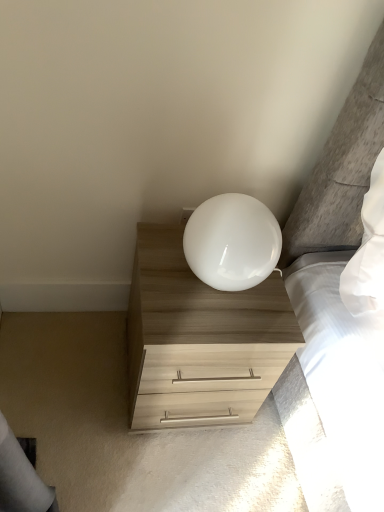
Image resolution: width=384 pixels, height=512 pixels. I want to click on light wood/texture chest of drawers at lower right, so click(x=200, y=339).

Describe the element at coordinates (200, 339) in the screenshot. I see `light wood/texture chest of drawers at lower right` at that location.

Where is `white glossy lamp at upper center`? The height and width of the screenshot is (512, 384). white glossy lamp at upper center is located at coordinates (232, 242).

What do you see at coordinates (232, 242) in the screenshot?
I see `white glossy lamp at upper center` at bounding box center [232, 242].

Find the location of a particular element. light wood/texture chest of drawers at lower right is located at coordinates (200, 339).

Can you confirm if white glossy lamp at upper center is positioned to the left of light wood/texture chest of drawers at lower right?

No, white glossy lamp at upper center is not to the left of light wood/texture chest of drawers at lower right.

Which object is closer to the camera taking this photo, white glossy lamp at upper center or light wood/texture chest of drawers at lower right?

white glossy lamp at upper center.

Does point (244, 242) appear closer or farther from the camera than point (240, 307)?

Point (244, 242) is positioned closer to the camera compared to point (240, 307).

From the picture: From the image's perspective, is white glossy lamp at upper center located above or below light wood/texture chest of drawers at lower right?

white glossy lamp at upper center is situated higher than light wood/texture chest of drawers at lower right in the image.

From a real-world perspective, is white glossy lamp at upper center physically above light wood/texture chest of drawers at lower right?

Yes, from a real-world perspective, white glossy lamp at upper center is over light wood/texture chest of drawers at lower right

Looking at this image, which of these two, white glossy lamp at upper center or light wood/texture chest of drawers at lower right, is thinner?

With smaller width is white glossy lamp at upper center.

Does white glossy lamp at upper center have a lesser height compared to light wood/texture chest of drawers at lower right?

Correct, white glossy lamp at upper center is not as tall as light wood/texture chest of drawers at lower right.

Can you confirm if white glossy lamp at upper center is bigger than light wood/texture chest of drawers at lower right?

Actually, white glossy lamp at upper center might be smaller than light wood/texture chest of drawers at lower right.

Is light wood/texture chest of drawers at lower right located within white glossy lamp at upper center?

No, light wood/texture chest of drawers at lower right is not a part of white glossy lamp at upper center.

Are white glossy lamp at upper center and light wood/texture chest of drawers at lower right making contact?

No, white glossy lamp at upper center is not touching light wood/texture chest of drawers at lower right.

Is white glossy lamp at upper center facing towards light wood/texture chest of drawers at lower right?

No, white glossy lamp at upper center is not turned towards light wood/texture chest of drawers at lower right.

The height and width of the screenshot is (512, 384). I want to click on chest of drawers lying on the left of white glossy lamp at upper center, so click(x=200, y=339).

Is light wood/texture chest of drawers at lower right to the left of white glossy lamp at upper center from the viewer's perspective?

Yes, light wood/texture chest of drawers at lower right is to the left of white glossy lamp at upper center.

Who is more distant, light wood/texture chest of drawers at lower right or white glossy lamp at upper center?

light wood/texture chest of drawers at lower right is more distant.

Between point (263, 351) and point (198, 207), which one is positioned behind?

The point (263, 351) is more distant.

From the image's perspective, would you say light wood/texture chest of drawers at lower right is shown under white glossy lamp at upper center?

Yes, from the image's perspective, light wood/texture chest of drawers at lower right is beneath white glossy lamp at upper center.

In the scene shown: From a real-world perspective, is light wood/texture chest of drawers at lower right above or below white glossy lamp at upper center?

light wood/texture chest of drawers at lower right is situated lower than white glossy lamp at upper center in the real world.

Can you confirm if light wood/texture chest of drawers at lower right is thinner than white glossy lamp at upper center?

No.

Considering the relative sizes of light wood/texture chest of drawers at lower right and white glossy lamp at upper center in the image provided, is light wood/texture chest of drawers at lower right shorter than white glossy lamp at upper center?

No.

Which of these two, light wood/texture chest of drawers at lower right or white glossy lamp at upper center, is bigger?

With larger size is light wood/texture chest of drawers at lower right.

Is light wood/texture chest of drawers at lower right located outside white glossy lamp at upper center?

That's correct, light wood/texture chest of drawers at lower right is outside of white glossy lamp at upper center.

Is the surface of light wood/texture chest of drawers at lower right in direct contact with white glossy lamp at upper center?

They are not placed beside each other.

Is light wood/texture chest of drawers at lower right facing away from white glossy lamp at upper center?

light wood/texture chest of drawers at lower right is not turned away from white glossy lamp at upper center.

Measure the distance between light wood/texture chest of drawers at lower right and white glossy lamp at upper center.

The distance of light wood/texture chest of drawers at lower right from white glossy lamp at upper center is 7.98 inches.

Identify the location of lamp that is above the light wood/texture chest of drawers at lower right (from the image's perspective). The width and height of the screenshot is (384, 512). (232, 242).

Find the location of a particular element. Image resolution: width=384 pixels, height=512 pixels. chest of drawers on the left of the white glossy lamp at upper center is located at coordinates (200, 339).

The height and width of the screenshot is (512, 384). In order to click on the chest of drawers below the white glossy lamp at upper center (from a real-world perspective) in this screenshot , I will do `click(200, 339)`.